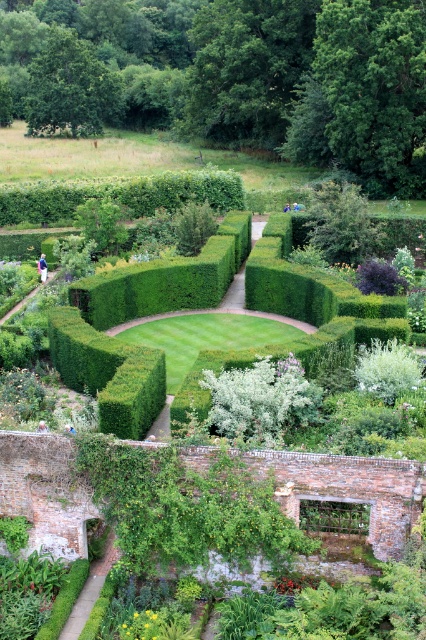
You are a gardener who needs to trim the white fluffy bush at center and the light brown wooden bench at lower center. Which object requires trimming because it is taller?

The white fluffy bush at center requires trimming because it has a greater height compared to the light brown wooden bench at lower center.

You are standing at the entrance of the hedge maze and want to reach the white fluffy bush at center. According to the coordinates provided, in which direction should you move first?

The white fluffy bush at center is located at coordinates point [261,401], so you should move towards the center of the maze first.